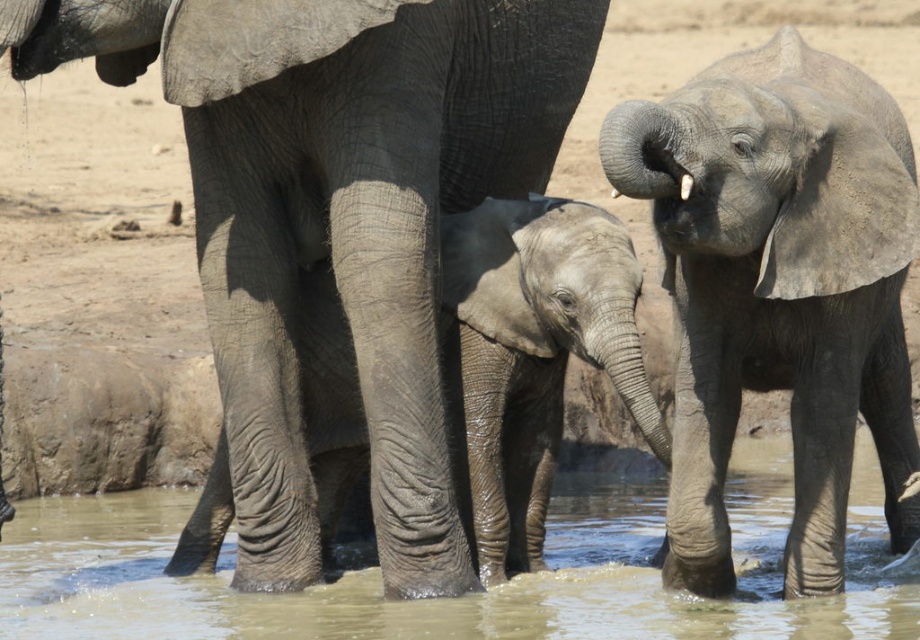
You are a wildlife photographer aiming to capture a photo of the gray wrinkled elephant at center and the brown muddy water at center. Your camera has a lens that can focus on objects within a 1 meter range. Can you focus on both subjects simultaneously?

The gray wrinkled elephant at center and brown muddy water at center are 1.17 meters apart from each other. Since the distance between them exceeds the 1 meter focus range of your camera lens, you cannot focus on both subjects simultaneously.

Based on the coordinates provided, where exactly is the gray wrinkled elephant at center located in the image?

The gray wrinkled elephant at center is located at point coordinates of (x=336, y=216).

You are a photographer trying to capture the gray wrinkled elephant at center and the gray textured baby elephant at center. Which elephant is closer to the camera based on their positions?

The gray wrinkled elephant at center is closer to the camera because it is positioned over the gray textured baby elephant at center, indicating it is in front.